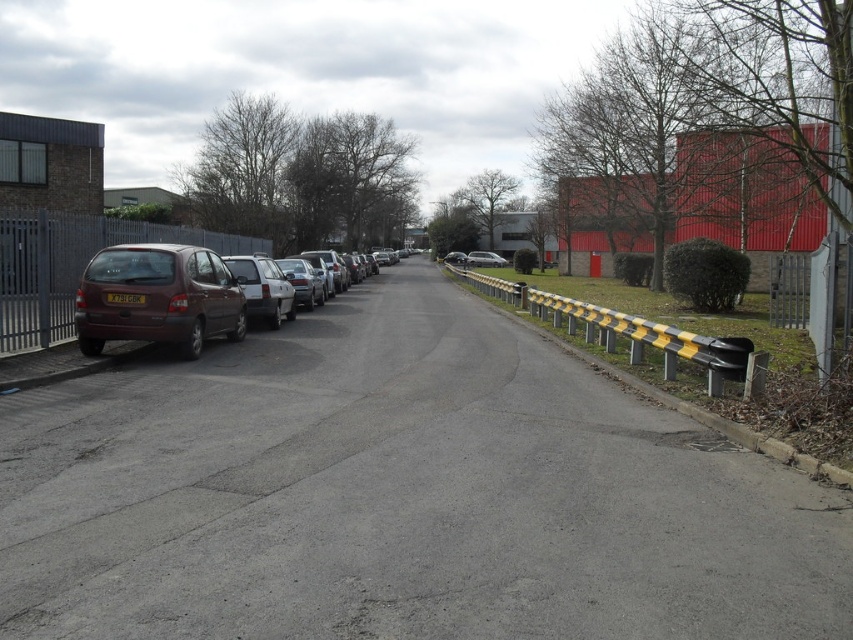
You are standing at the origin point of this street scene. Where is the matte brown minivan at left located in terms of coordinates?

The matte brown minivan at left is located at coordinates point (157, 298).